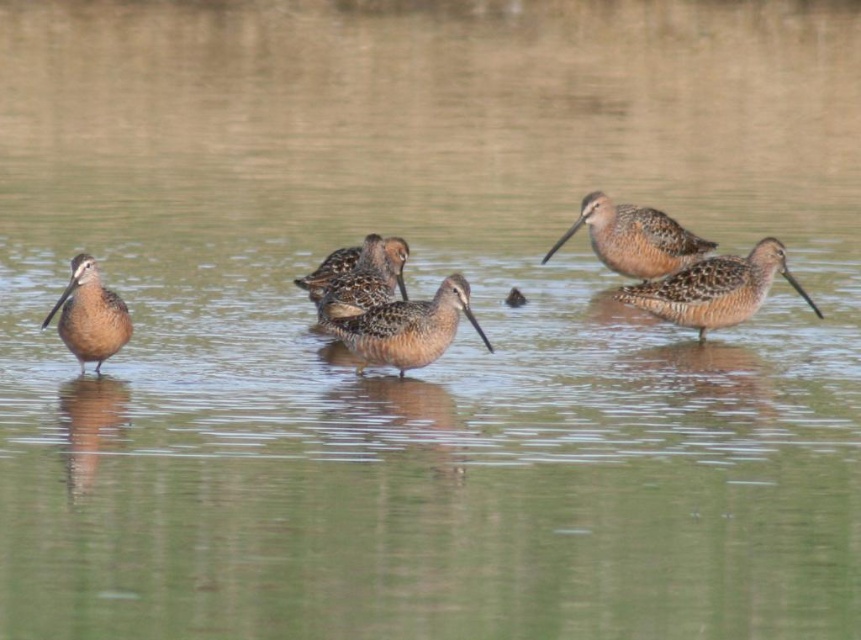
You are a wildlife photographer aiming to capture a closeup shot of the brown speckled feathers at right and the brown speckled bird at left. Based on their sizes, which one should you focus on first if you want to ensure both are in the frame without moving the camera?

The brown speckled feathers at right has a greater height compared to the brown speckled bird at left. Therefore, focusing on the taller brown speckled feathers at right first will ensure both fit within the frame since it occupies more vertical space.

You are a wildlife photographer trying to capture a photo of the brown matte bird at center and the brown speckled bird at left. Based on their positions, which bird would appear closer to the camera in the photo?

The brown matte bird at center appears closer to the camera because it is located above the brown speckled bird at left in the image, which typically indicates a higher position in the frame and thus closer proximity.